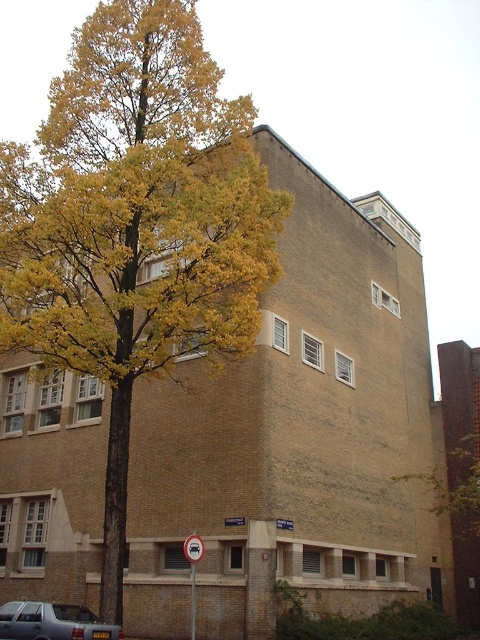
Can you confirm if yellow leafy tree at upper left is bigger than silver metallic car at lower left?

Indeed, yellow leafy tree at upper left has a larger size compared to silver metallic car at lower left.

Is yellow leafy tree at upper left below silver metallic car at lower left?

No.

Which is behind, point (474, 444) or point (55, 627)?

The point (474, 444) is more distant.

Where is `yellow leafy tree at upper left`? Image resolution: width=480 pixels, height=640 pixels. yellow leafy tree at upper left is located at coordinates (456, 486).

Can you confirm if yellow-green leaves at center is taller than yellow leafy tree at upper left?

Yes, yellow-green leaves at center is taller than yellow leafy tree at upper left.

Is point (83, 77) behind point (469, 529)?

No, (83, 77) is in front of (469, 529).

The height and width of the screenshot is (640, 480). Describe the element at coordinates (135, 225) in the screenshot. I see `yellow-green leaves at center` at that location.

Where is `yellow-green leaves at center`? The height and width of the screenshot is (640, 480). yellow-green leaves at center is located at coordinates (135, 225).

Is yellow-green leaves at center shorter than silver metallic car at lower left?

In fact, yellow-green leaves at center may be taller than silver metallic car at lower left.

Describe the element at coordinates (135, 225) in the screenshot. Image resolution: width=480 pixels, height=640 pixels. I see `yellow-green leaves at center` at that location.

Is point (101, 4) positioned in front of point (72, 621)?

That is False.

I want to click on yellow-green leaves at center, so click(135, 225).